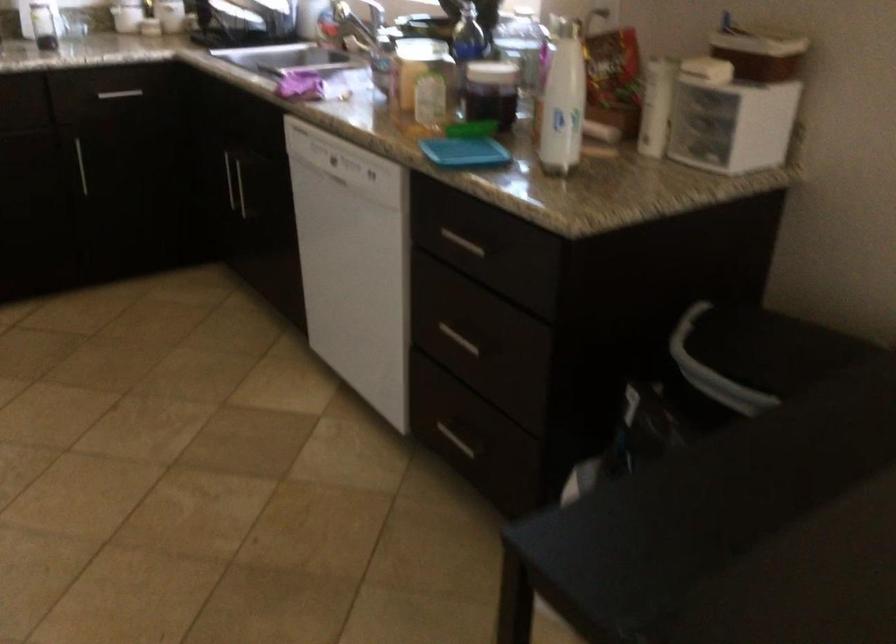
The image size is (896, 644). Describe the element at coordinates (459, 339) in the screenshot. I see `a small drawer pull` at that location.